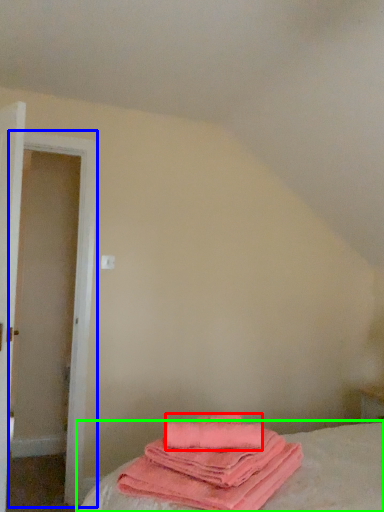
Question: Based on their relative distances, which object is nearer to beach towel (highlighted by a red box)? Choose from door (highlighted by a blue box) and bed (highlighted by a green box).

Choices:
 (A) door
 (B) bed

Answer: (B)